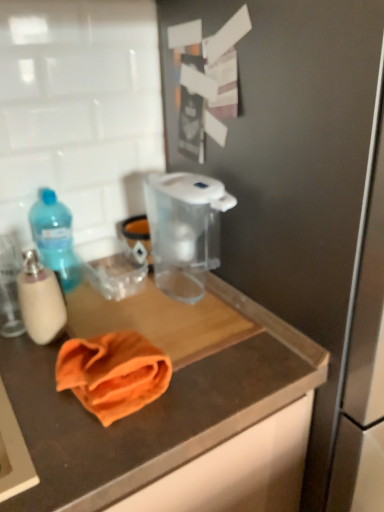
The width and height of the screenshot is (384, 512). I want to click on translucent plastic soap dispenser at left, acting as the 1th bottle starting from the front, so click(x=40, y=300).

Locate an element on the screen. Image resolution: width=384 pixels, height=512 pixels. transparent plastic pitcher at center is located at coordinates (184, 229).

Does transparent plastic pitcher at center have a greater width compared to blue translucent bottle at left, which is the 2th bottle in front-to-back order?

Correct, the width of transparent plastic pitcher at center exceeds that of blue translucent bottle at left, which is the 2th bottle in front-to-back order.

Considering the points (184, 172) and (44, 228), which point is in front, point (184, 172) or point (44, 228)?

The point (184, 172) is in front.

From a real-world perspective, is transparent plastic pitcher at center located higher than blue translucent bottle at left, the first bottle when ordered from back to front?

Yes, from a real-world perspective, transparent plastic pitcher at center is above blue translucent bottle at left, the first bottle when ordered from back to front.

Based on the photo, is transparent plastic pitcher at center oriented towards blue translucent bottle at left, the first bottle when ordered from back to front?

No.

Are transparent plastic pitcher at center and orange cloth at center located far from each other?

No, transparent plastic pitcher at center is not far from orange cloth at center.

Considering the sizes of objects transparent plastic pitcher at center and orange cloth at center in the image provided, who is shorter, transparent plastic pitcher at center or orange cloth at center?

orange cloth at center.

Is transparent plastic pitcher at center in front of or behind orange cloth at center in the image?

Visually, transparent plastic pitcher at center is located behind orange cloth at center.

Which of these two, transparent plastic pitcher at center or orange cloth at center, is wider?

Wider between the two is transparent plastic pitcher at center.

Does blue translucent bottle at left, which is the 2th bottle in front-to-back order, have a lesser width compared to orange cloth at center?

Yes, blue translucent bottle at left, which is the 2th bottle in front-to-back order, is thinner than orange cloth at center.

Are blue translucent bottle at left, which is the 2th bottle in front-to-back order, and orange cloth at center far apart?

No.

Which point is more forward, (58, 206) or (85, 392)?

The point (85, 392) is in front.

Considering the relative sizes of orange cloth at center and transparent plastic pitcher at center in the image provided, is orange cloth at center bigger than transparent plastic pitcher at center?

Incorrect, orange cloth at center is not larger than transparent plastic pitcher at center.

Considering the points (134, 362) and (197, 251), which point is in front, point (134, 362) or point (197, 251)?

Point (134, 362)

Is orange cloth at center wider than transparent plastic pitcher at center?

No.

How different are the orientations of orange cloth at center and transparent plastic pitcher at center in degrees?

The angle between the facing direction of orange cloth at center and the facing direction of transparent plastic pitcher at center is 1.45 degrees.

Who is smaller, translucent plastic soap dispenser at left, which appears as the second bottle when viewed from the back, or blue translucent bottle at left, the first bottle when ordered from back to front?

Smaller between the two is translucent plastic soap dispenser at left, which appears as the second bottle when viewed from the back.

Choose the correct answer: Is translucent plastic soap dispenser at left, acting as the 1th bottle starting from the front, inside blue translucent bottle at left, which is the 2th bottle in front-to-back order, or outside it?

translucent plastic soap dispenser at left, acting as the 1th bottle starting from the front, cannot be found inside blue translucent bottle at left, which is the 2th bottle in front-to-back order.

From the picture: Could you tell me if translucent plastic soap dispenser at left, acting as the 1th bottle starting from the front, is turned towards blue translucent bottle at left, which is the 2th bottle in front-to-back order?

No, translucent plastic soap dispenser at left, acting as the 1th bottle starting from the front, is not turned towards blue translucent bottle at left, which is the 2th bottle in front-to-back order.

Are translucent plastic soap dispenser at left, acting as the 1th bottle starting from the front, and blue translucent bottle at left, the first bottle when ordered from back to front, far apart?

No, there isn't a large distance between translucent plastic soap dispenser at left, acting as the 1th bottle starting from the front, and blue translucent bottle at left, the first bottle when ordered from back to front.

Between orange cloth at center and translucent plastic soap dispenser at left, acting as the 1th bottle starting from the front, which one has smaller width?

translucent plastic soap dispenser at left, acting as the 1th bottle starting from the front.

Are orange cloth at center and translucent plastic soap dispenser at left, acting as the 1th bottle starting from the front, making contact?

No.

Is orange cloth at center oriented away from blue translucent bottle at left, the first bottle when ordered from back to front?

No, orange cloth at center is not facing the opposite direction of blue translucent bottle at left, the first bottle when ordered from back to front.

Considering the points (67, 355) and (77, 269), which point is in front, point (67, 355) or point (77, 269)?

The point (67, 355) is closer to the camera.

What's the angular difference between orange cloth at center and blue translucent bottle at left, which is the 2th bottle in front-to-back order,'s facing directions?

orange cloth at center and blue translucent bottle at left, which is the 2th bottle in front-to-back order, are facing 1.45 degrees away from each other.

Looking at this image, from the image's perspective, which is below, orange cloth at center or blue translucent bottle at left, which is the 2th bottle in front-to-back order?

orange cloth at center, from the image's perspective.

Where is `appliance above the blue translucent bottle at left, the first bottle when ordered from back to front (from the image's perspective)`? Image resolution: width=384 pixels, height=512 pixels. appliance above the blue translucent bottle at left, the first bottle when ordered from back to front (from the image's perspective) is located at coordinates (184, 229).

Where is `appliance on the right of orange cloth at center`? appliance on the right of orange cloth at center is located at coordinates (184, 229).

From the image, which object appears to be nearer to orange cloth at center, translucent plastic soap dispenser at left, which appears as the second bottle when viewed from the back, or transparent plastic pitcher at center?

translucent plastic soap dispenser at left, which appears as the second bottle when viewed from the back, lies closer to orange cloth at center than the other object.

Which object lies further to the anchor point translucent plastic soap dispenser at left, which appears as the second bottle when viewed from the back, blue translucent bottle at left, the first bottle when ordered from back to front, or orange cloth at center?

blue translucent bottle at left, the first bottle when ordered from back to front, lies further to translucent plastic soap dispenser at left, which appears as the second bottle when viewed from the back, than the other object.

Looking at the image, which one is located closer to translucent plastic soap dispenser at left, acting as the 1th bottle starting from the front, orange cloth at center or transparent plastic pitcher at center?

orange cloth at center is closer to translucent plastic soap dispenser at left, acting as the 1th bottle starting from the front.

Estimate the real-world distances between objects in this image. Which object is closer to transparent plastic pitcher at center, orange cloth at center or translucent plastic soap dispenser at left, acting as the 1th bottle starting from the front?

orange cloth at center is positioned closer to the anchor transparent plastic pitcher at center.

When comparing their distances from blue translucent bottle at left, which is the 2th bottle in front-to-back order, does translucent plastic soap dispenser at left, which appears as the second bottle when viewed from the back, or transparent plastic pitcher at center seem closer?

translucent plastic soap dispenser at left, which appears as the second bottle when viewed from the back, is closer to blue translucent bottle at left, which is the 2th bottle in front-to-back order.

Which object lies nearer to the anchor point orange cloth at center, blue translucent bottle at left, the first bottle when ordered from back to front, or transparent plastic pitcher at center?

Among the two, transparent plastic pitcher at center is located nearer to orange cloth at center.

Which object lies further to the anchor point blue translucent bottle at left, which is the 2th bottle in front-to-back order, orange cloth at center or translucent plastic soap dispenser at left, acting as the 1th bottle starting from the front?

Among the two, orange cloth at center is located further to blue translucent bottle at left, which is the 2th bottle in front-to-back order.

Looking at the image, which one is located further to transparent plastic pitcher at center, orange cloth at center or blue translucent bottle at left, the first bottle when ordered from back to front?

orange cloth at center.

Where is `bottle between blue translucent bottle at left, the first bottle when ordered from back to front, and transparent plastic pitcher at center`? Image resolution: width=384 pixels, height=512 pixels. bottle between blue translucent bottle at left, the first bottle when ordered from back to front, and transparent plastic pitcher at center is located at coordinates (40, 300).

Locate an element on the screen. The width and height of the screenshot is (384, 512). appliance between orange cloth at center and blue translucent bottle at left, the first bottle when ordered from back to front, from front to back is located at coordinates (184, 229).

This screenshot has height=512, width=384. What are the coordinates of `towel/napkin between translucent plastic soap dispenser at left, acting as the 1th bottle starting from the front, and transparent plastic pitcher at center from left to right` in the screenshot? It's located at pyautogui.click(x=113, y=373).

At what (x,y) coordinates should I click in order to perform the action: click on bottle positioned between orange cloth at center and blue translucent bottle at left, the first bottle when ordered from back to front, from near to far. Please return your answer as a coordinate pair (x, y). Image resolution: width=384 pixels, height=512 pixels. Looking at the image, I should click on (40, 300).